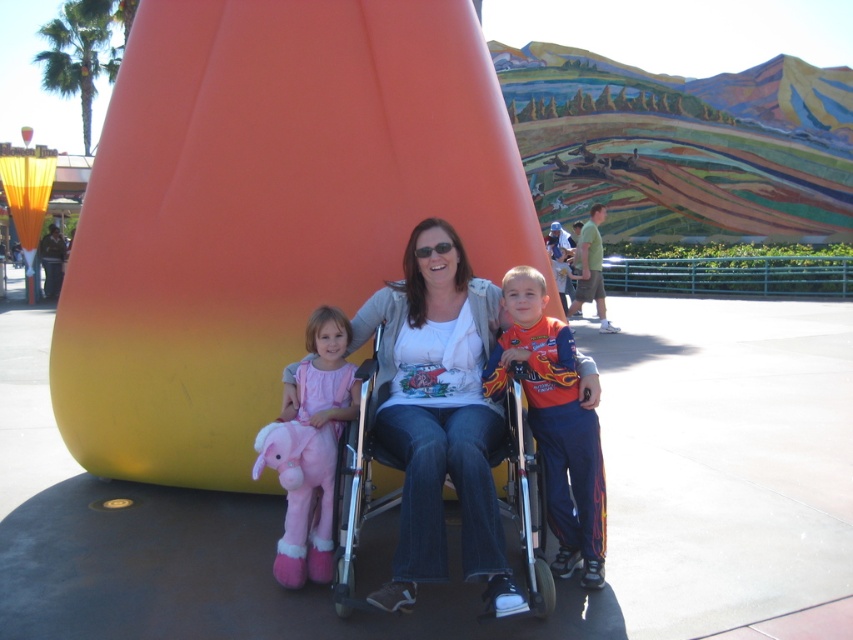
Question: Based on their relative distances, which object is nearer to the pink plush toy at left?

Choices:
 (A) flame-patterned jersey at center
 (B) metallic silver wheelchair at center

Answer: (B)

Question: Is metallic silver wheelchair at center below pink plush toy at left?

Choices:
 (A) yes
 (B) no

Answer: (A)

Question: Is the position of flame-patterned jersey at center more distant than that of metallic silver wheelchair at center?

Choices:
 (A) no
 (B) yes

Answer: (B)

Question: Which object is farther from the camera taking this photo?

Choices:
 (A) flame-patterned jersey at center
 (B) metallic silver wheelchair at center
 (C) pink plush toy at left

Answer: (A)

Question: Which point is farther to the camera?

Choices:
 (A) (535, 529)
 (B) (306, 504)
 (C) (569, 566)

Answer: (C)

Question: Is flame-patterned jersey at center thinner than metallic silver wheelchair at center?

Choices:
 (A) no
 (B) yes

Answer: (A)